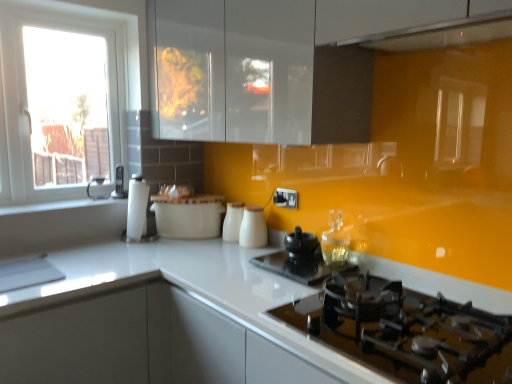
Question: In which direction should I rotate to look at black glass kettle at center, which is the second appliance in right-to-left order?

Choices:
 (A) right
 (B) left

Answer: (A)

Question: From a real-world perspective, is matte black kettle at left, marked as the third appliance in a right-to-left arrangement, under white glossy countertop at center?

Choices:
 (A) yes
 (B) no

Answer: (B)

Question: Is matte black kettle at left, the first appliance in the back-to-front sequence, at the right side of white glossy countertop at center?

Choices:
 (A) no
 (B) yes

Answer: (A)

Question: Considering the relative sizes of matte black kettle at left, which is the first appliance in left-to-right order, and white glossy countertop at center in the image provided, is matte black kettle at left, which is the first appliance in left-to-right order, thinner than white glossy countertop at center?

Choices:
 (A) no
 (B) yes

Answer: (B)

Question: Considering the relative sizes of matte black kettle at left, the first appliance in the back-to-front sequence, and white glossy countertop at center in the image provided, is matte black kettle at left, the first appliance in the back-to-front sequence, taller than white glossy countertop at center?

Choices:
 (A) yes
 (B) no

Answer: (B)

Question: From a real-world perspective, is matte black kettle at left, marked as the third appliance in a right-to-left arrangement, on white glossy countertop at center?

Choices:
 (A) yes
 (B) no

Answer: (A)

Question: Considering the relative sizes of matte black kettle at left, which is the first appliance in left-to-right order, and white glossy countertop at center in the image provided, is matte black kettle at left, which is the first appliance in left-to-right order, smaller than white glossy countertop at center?

Choices:
 (A) yes
 (B) no

Answer: (A)

Question: Is black glass kettle at center, marked as the 3th appliance in a back-to-front arrangement, to the right of white glossy milk jugs at center, the second kitchen appliance in the right-to-left sequence, from the viewer's perspective?

Choices:
 (A) no
 (B) yes

Answer: (B)

Question: From a real-world perspective, is black glass kettle at center, the first appliance when ordered from bottom to top, positioned over white glossy milk jugs at center, which is counted as the second kitchen appliance, starting from the left, based on gravity?

Choices:
 (A) no
 (B) yes

Answer: (A)

Question: Is black glass kettle at center, marked as the 3th appliance in a top-to-bottom arrangement, positioned beyond the bounds of white glossy milk jugs at center, which is counted as the second kitchen appliance, starting from the left?

Choices:
 (A) yes
 (B) no

Answer: (A)

Question: From the image's perspective, is black glass kettle at center, which is the second appliance in right-to-left order, beneath white glossy milk jugs at center, the second kitchen appliance in the right-to-left sequence?

Choices:
 (A) yes
 (B) no

Answer: (A)

Question: Considering the relative sizes of black glass kettle at center, marked as the 3th appliance in a top-to-bottom arrangement, and white glossy milk jugs at center, the second kitchen appliance in the right-to-left sequence, in the image provided, is black glass kettle at center, marked as the 3th appliance in a top-to-bottom arrangement, shorter than white glossy milk jugs at center, the second kitchen appliance in the right-to-left sequence,?

Choices:
 (A) yes
 (B) no

Answer: (A)

Question: From the image's perspective, is black glass kettle at center, the first appliance viewed from the front, on top of white glossy milk jugs at center, the second kitchen appliance in the right-to-left sequence?

Choices:
 (A) no
 (B) yes

Answer: (A)

Question: From the image's perspective, is white glossy cabinet at lower left under white ceramic bowl at center, which is counted as the third kitchen appliance, starting from the right?

Choices:
 (A) no
 (B) yes

Answer: (B)